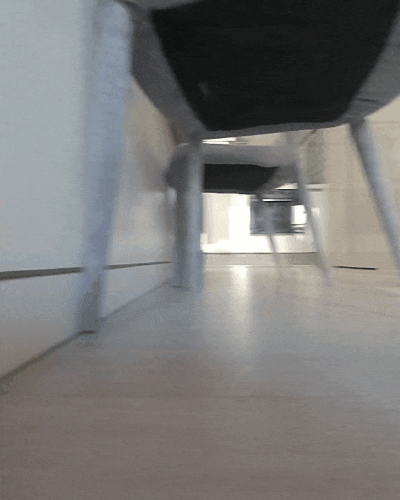
Image resolution: width=400 pixels, height=500 pixels. I want to click on area underneath chairs, so click(281, 86).